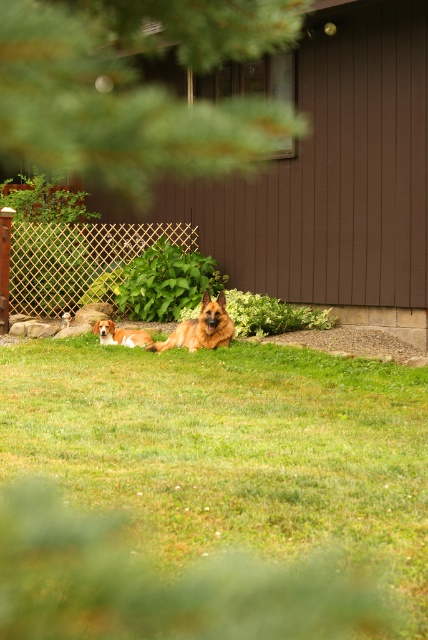
You are standing in front of the house looking at the two dogs resting on the grassy lawn. Which of the two points, point [323,490] or point [214,333], is closer to you?

Point [323,490] is closer to the viewer than point [214,333].

In the scene shown: You are a photographer trying to capture a closeup of the golden fur dog at center. The green grass at center is blocking your view. Can you estimate if the grass is wider than the dog?

The green grass at center might be wider than golden fur dog at center, so there is a possibility that the grass is blocking the view of the dog.

Based on the photo, you are a photographer trying to capture a clear shot of the green grass at center and the golden fur dog at center. Since there is a tree branch in the foreground, which object might be partially obscured by the branch?

The green grass at center is more likely to be partially obscured by the tree branch in the foreground because it occupies less space compared to the golden fur dog at center, making it easier to be covered by the branch.